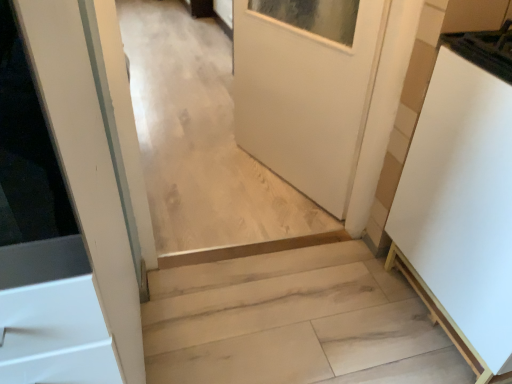
Question: Looking at their shapes, would you say white matte cabinet at right is wider or thinner than light wood stairs at center?

Choices:
 (A) thin
 (B) wide

Answer: (A)

Question: Would you say white matte cabinet at right is to the left or to the right of light wood stairs at center in the picture?

Choices:
 (A) left
 (B) right

Answer: (B)

Question: From the image's perspective, is white matte cabinet at right above or below light wood stairs at center?

Choices:
 (A) below
 (B) above

Answer: (B)

Question: In terms of size, does light wood stairs at center appear bigger or smaller than white matte cabinet at right?

Choices:
 (A) big
 (B) small

Answer: (B)

Question: From a real-world perspective, is light wood stairs at center positioned above or below white matte cabinet at right?

Choices:
 (A) below
 (B) above

Answer: (A)

Question: Is light wood stairs at center wider or thinner than white matte cabinet at right?

Choices:
 (A) thin
 (B) wide

Answer: (B)

Question: Is point (373, 297) positioned closer to the camera than point (466, 74)?

Choices:
 (A) farther
 (B) closer

Answer: (A)